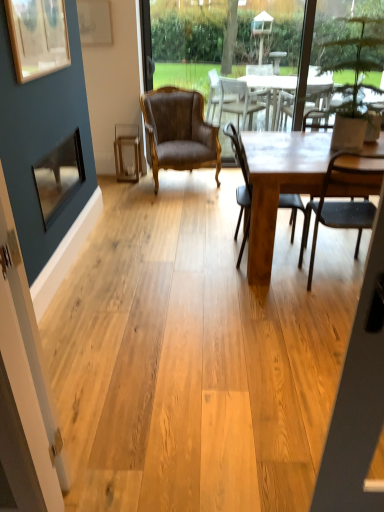
Where is `vacant space in front of brown leather armchair at center, acting as the first chair starting from the back`? The height and width of the screenshot is (512, 384). vacant space in front of brown leather armchair at center, acting as the first chair starting from the back is located at coordinates (165, 203).